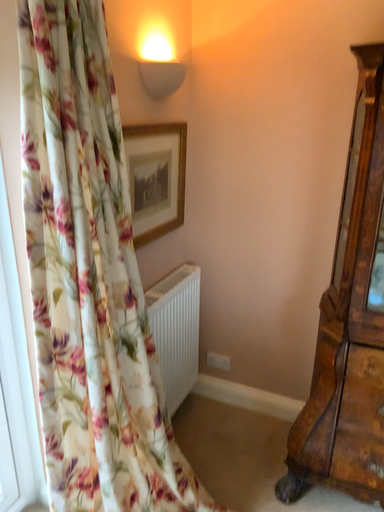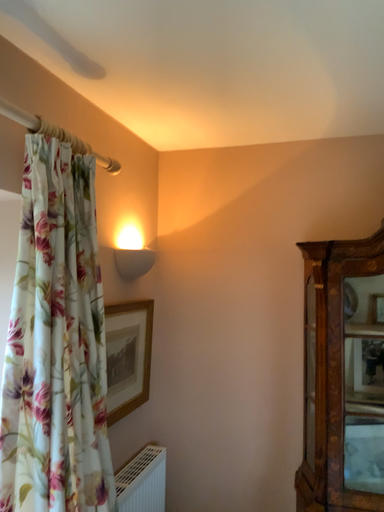
Question: How did the camera likely rotate when shooting the video?

Choices:
 (A) rotated downward
 (B) rotated upward

Answer: (B)